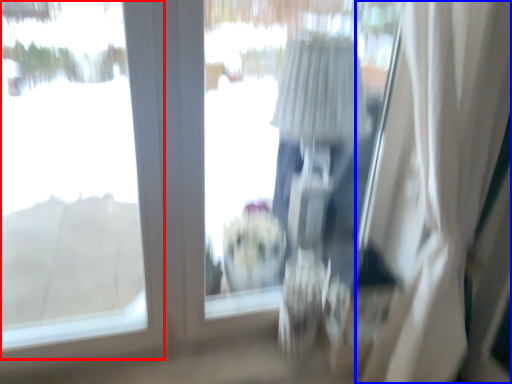
Question: Which point is further to the camera, window (highlighted by a red box) or curtain (highlighted by a blue box)?

Choices:
 (A) window
 (B) curtain

Answer: (A)